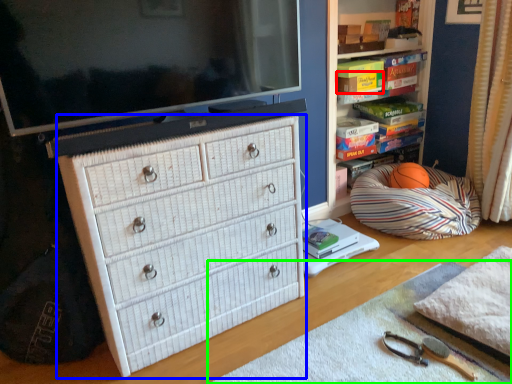
Question: Estimate the real-world distances between objects in this image. Which object is closer to book (highlighted by a red box), chest of drawers (highlighted by a blue box) or plain (highlighted by a green box)?

Choices:
 (A) chest of drawers
 (B) plain

Answer: (A)